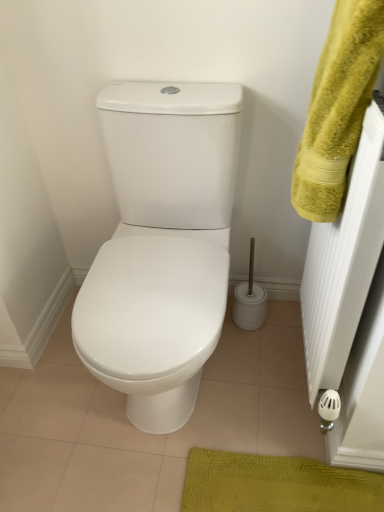
Question: Should I look upward or downward to see white glossy toilet at center?

Choices:
 (A) up
 (B) down

Answer: (A)

Question: Is yellow fluffy towel at upper right not near white glossy toilet at center?

Choices:
 (A) no
 (B) yes

Answer: (A)

Question: Does yellow fluffy towel at upper right have a larger size compared to white glossy toilet at center?

Choices:
 (A) yes
 (B) no

Answer: (B)

Question: Considering the relative sizes of yellow fluffy towel at upper right and white glossy toilet at center in the image provided, is yellow fluffy towel at upper right taller than white glossy toilet at center?

Choices:
 (A) yes
 (B) no

Answer: (B)

Question: Considering the relative positions of yellow fluffy towel at upper right and white glossy toilet at center in the image provided, is yellow fluffy towel at upper right to the left of white glossy toilet at center from the viewer's perspective?

Choices:
 (A) no
 (B) yes

Answer: (A)

Question: From a real-world perspective, is yellow fluffy towel at upper right physically below white glossy toilet at center?

Choices:
 (A) no
 (B) yes

Answer: (A)

Question: Is yellow fluffy towel at upper right at the right side of white glossy toilet at center?

Choices:
 (A) no
 (B) yes

Answer: (B)

Question: Considering the relative sizes of white glossy toilet at center and yellow fluffy towel at upper right in the image provided, is white glossy toilet at center smaller than yellow fluffy towel at upper right?

Choices:
 (A) yes
 (B) no

Answer: (B)

Question: From the image's perspective, is white glossy toilet at center above yellow fluffy towel at upper right?

Choices:
 (A) no
 (B) yes

Answer: (A)

Question: Does white glossy toilet at center contain yellow fluffy towel at upper right?

Choices:
 (A) yes
 (B) no

Answer: (B)

Question: Would you say white glossy toilet at center is outside yellow fluffy towel at upper right?

Choices:
 (A) yes
 (B) no

Answer: (A)

Question: Is white glossy toilet at center positioned before yellow fluffy towel at upper right?

Choices:
 (A) no
 (B) yes

Answer: (A)

Question: Is the depth of white glossy toilet at center greater than that of yellow fluffy towel at upper right?

Choices:
 (A) no
 (B) yes

Answer: (B)

Question: Relative to white glossy toilet at center, is yellow fluffy towel at upper right in front or behind?

Choices:
 (A) front
 (B) behind

Answer: (A)